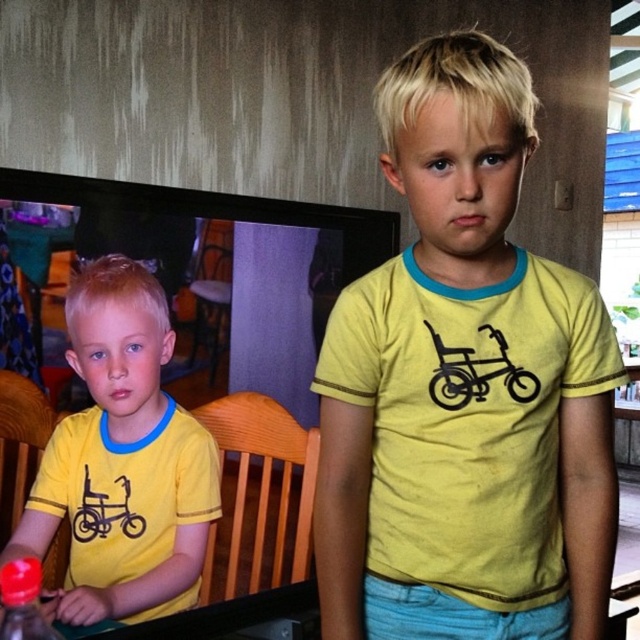
Between yellow matte shirt at center and matte yellow t-shirt at center, which one appears on the left side from the viewer's perspective?

matte yellow t-shirt at center is more to the left.

From the picture: Is yellow matte shirt at center shorter than matte yellow t-shirt at center?

No.

Which is in front, point (552, 618) or point (90, 358)?

Point (552, 618) is more forward.

At what (x,y) coordinates should I click in order to perform the action: click on yellow matte shirt at center. Please return your answer as a coordinate pair (x, y). The image size is (640, 640). Looking at the image, I should click on (465, 388).

Who is taller, yellow matte shirt at center or translucent plastic bottle at lower left?

yellow matte shirt at center is taller.

Which is behind, point (477, 273) or point (13, 577)?

The point (13, 577) is more distant.

Is point (422, 241) positioned in front of point (29, 564)?

Yes, point (422, 241) is closer to viewer.

Locate an element on the screen. Image resolution: width=640 pixels, height=640 pixels. yellow matte shirt at center is located at coordinates (465, 388).

Is matte yellow t-shirt at center to the left of translucent plastic bottle at lower left from the viewer's perspective?

No, matte yellow t-shirt at center is not to the left of translucent plastic bottle at lower left.

Can you confirm if matte yellow t-shirt at center is thinner than translucent plastic bottle at lower left?

No, matte yellow t-shirt at center is not thinner than translucent plastic bottle at lower left.

Between point (100, 284) and point (45, 624), which one is positioned in front?

Positioned in front is point (45, 624).

Where is `matte yellow t-shirt at center`? The width and height of the screenshot is (640, 640). matte yellow t-shirt at center is located at coordinates 122,461.